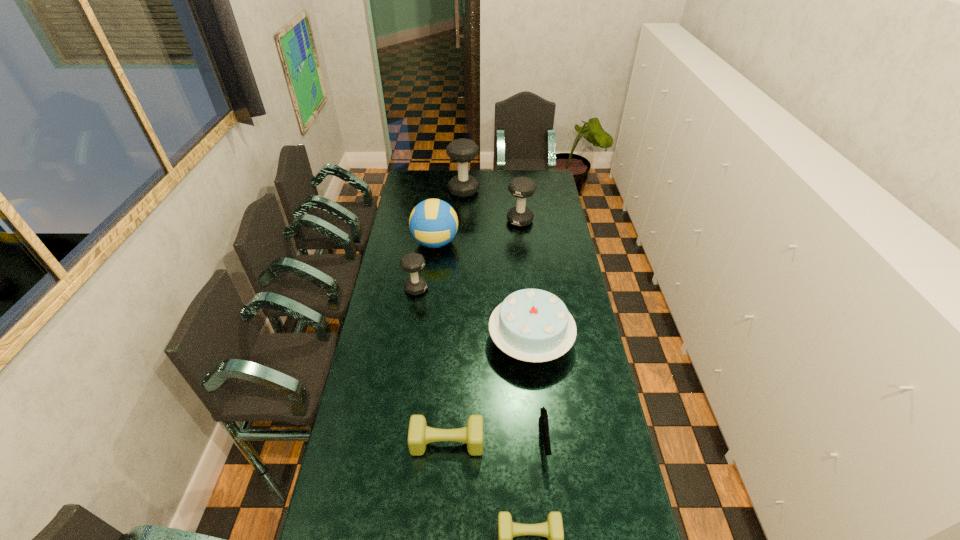
Identify the location of volleyball present at the left edge. (433, 223).

Identify the location of dumbbell present at the left edge. Image resolution: width=960 pixels, height=540 pixels. (412, 262).

Find the location of a particular element. object that is at the right edge is located at coordinates (533, 325).

You are a GUI agent. You are given a task and a screenshot of the screen. Output one action in this format:
    pyautogui.click(x=<x>, y=<y>)
    Task: Click on the vacant area at the far edge
    The width and height of the screenshot is (960, 540).
    Given the screenshot: What is the action you would take?
    pyautogui.click(x=516, y=173)

Locate an element on the screen. Image resolution: width=960 pixels, height=540 pixels. vacant space at the left edge of the desktop is located at coordinates (424, 199).

Image resolution: width=960 pixels, height=540 pixels. Find the location of `free space at the right edge`. free space at the right edge is located at coordinates pyautogui.click(x=549, y=276).

Locate an element on the screen. free space that is in between the third tallest dumbbell and the blue volleyball is located at coordinates (425, 266).

You are a GUI agent. You are given a task and a screenshot of the screen. Output one action in this format:
    pyautogui.click(x=<x>, y=<y>)
    Task: Click on the free space between the third farthest dumbbell and the pistol
    
    Given the screenshot: What is the action you would take?
    pyautogui.click(x=480, y=365)

You are a GUI agent. You are given a task and a screenshot of the screen. Output one action in this format:
    pyautogui.click(x=<x>, y=<y>)
    Task: Click on the free space between the fourth nearest object and the pistol
    
    Given the screenshot: What is the action you would take?
    pyautogui.click(x=537, y=391)

Locate an element on the screen. This screenshot has width=960, height=540. vacant area between the farther olive dumbbell and the second farthest gray dumbbell is located at coordinates (484, 332).